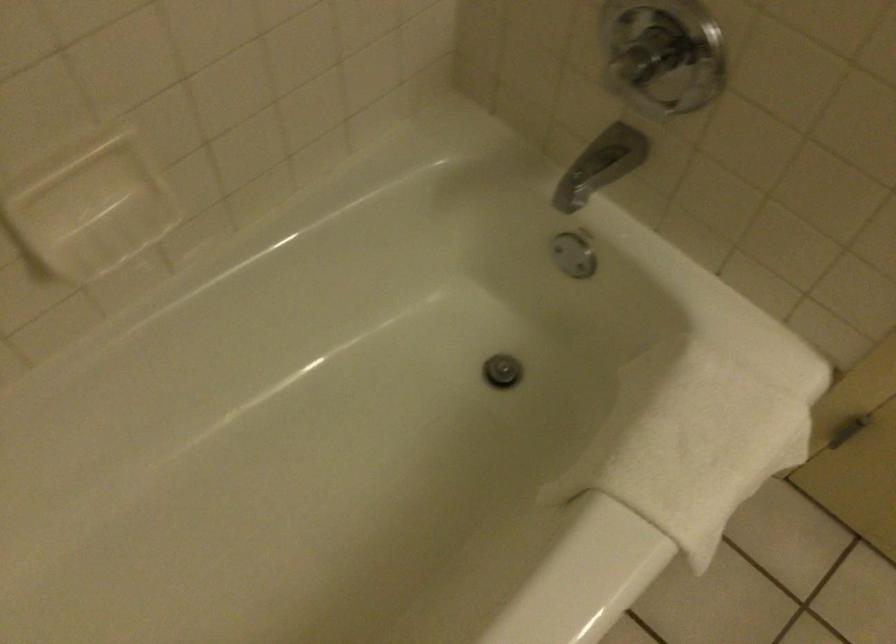
The height and width of the screenshot is (644, 896). What are the coordinates of `faucet diverter knob` in the screenshot? It's located at (573, 254).